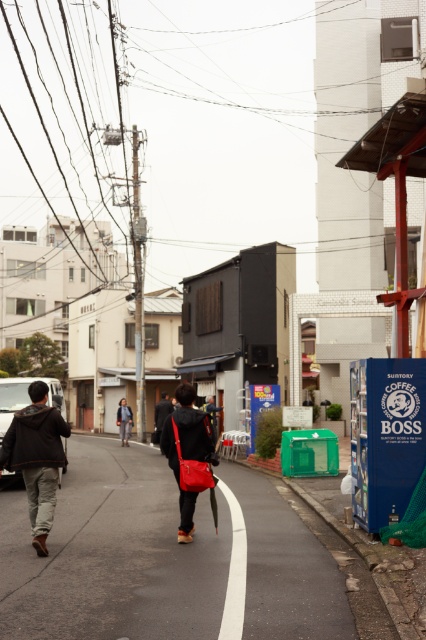
Who is positioned more to the right, black asphalt pavement at center or denim jacket at center?

black asphalt pavement at center is more to the right.

Identify the location of black asphalt pavement at center. (114, 554).

Who is higher up, dark gray hoodie at center or matte red bag at center?

dark gray hoodie at center is higher up.

Measure the distance between point (x=13, y=467) and camera.

They are 9.70 meters apart.

Is point (40, 515) behind point (169, 417)?

That is False.

Image resolution: width=426 pixels, height=640 pixels. In order to click on dark gray hoodie at center in this screenshot , I will do `click(37, 458)`.

Which is behind, point (45, 529) or point (121, 442)?

The point (121, 442) is behind.

Which is in front, point (36, 532) or point (118, 413)?

Point (36, 532) is in front.

At what (x,y) coordinates should I click in order to perform the action: click on dark gray hoodie at center. Please return your answer as a coordinate pair (x, y). The width and height of the screenshot is (426, 640). Looking at the image, I should click on (37, 458).